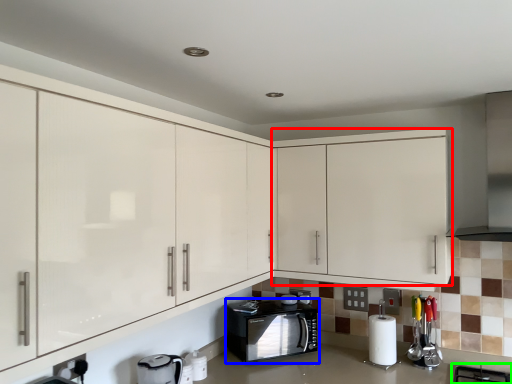
Question: Which object is the farthest from cabinetry (highlighted by a red box)? Choose among these: home appliance (highlighted by a blue box) or gas stove (highlighted by a green box).

Choices:
 (A) home appliance
 (B) gas stove

Answer: (B)